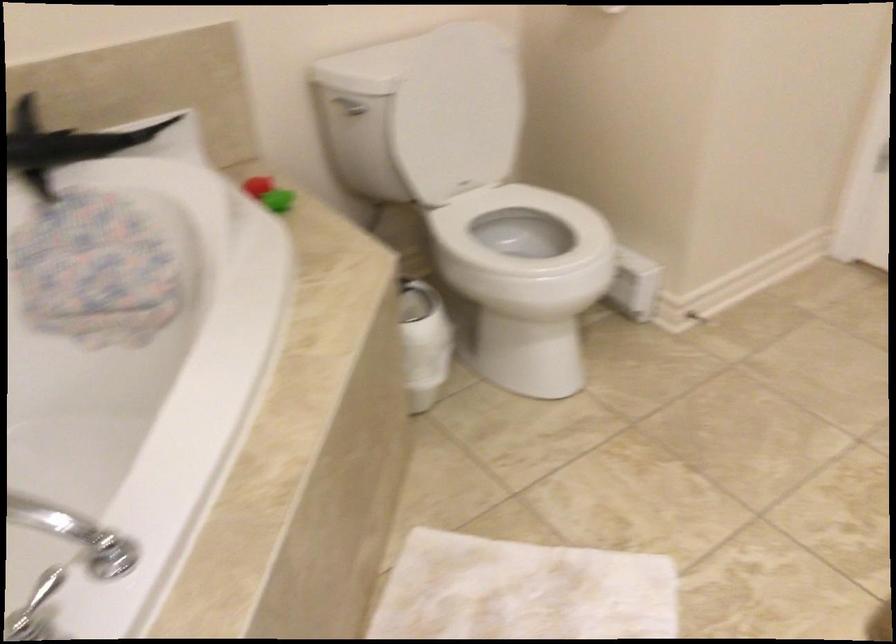
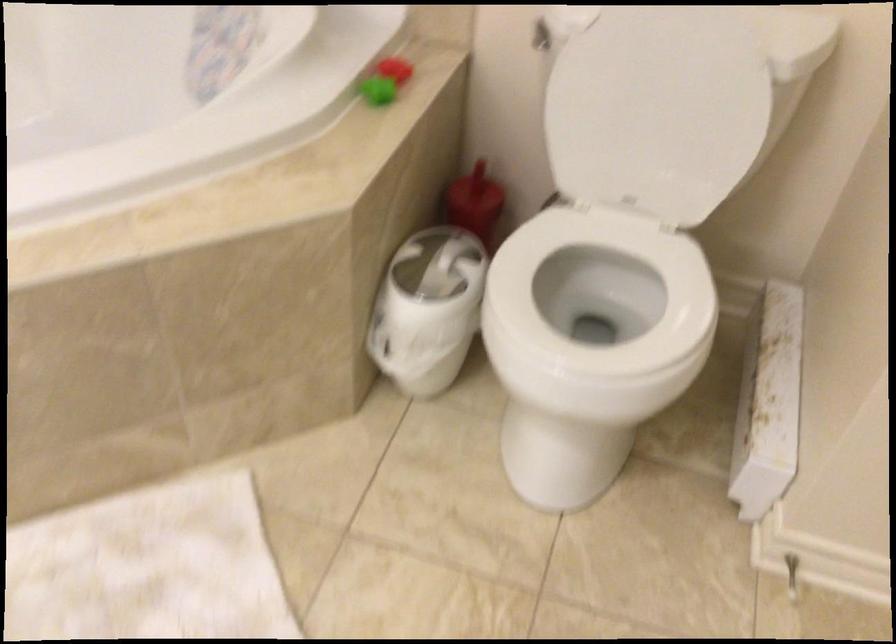
In the second image, find the point that corresponds to pixel 273 198 in the first image.

(377, 90)